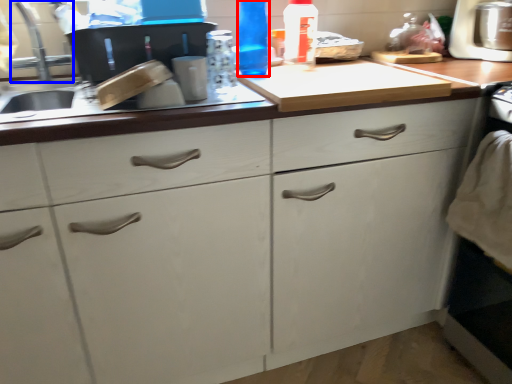
Question: Which of the following is the farthest to the observer, bottle (highlighted by a red box) or faucet (highlighted by a blue box)?

Choices:
 (A) bottle
 (B) faucet

Answer: (A)